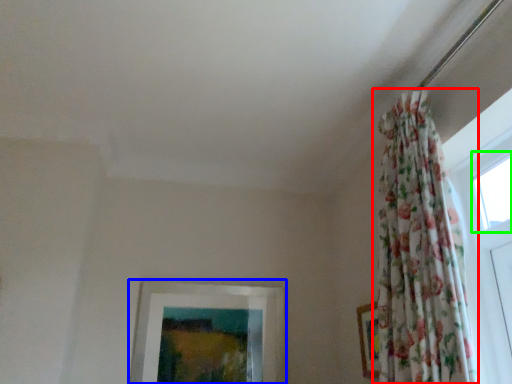
Question: Which is nearer to the curtain (highlighted by a red box)? picture frame (highlighted by a blue box) or window (highlighted by a green box).

Choices:
 (A) picture frame
 (B) window

Answer: (B)